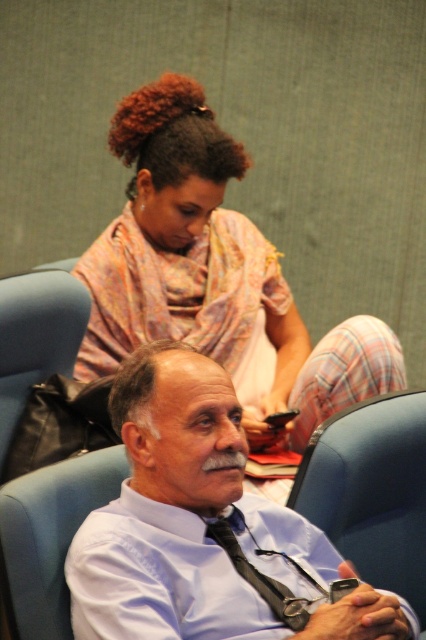
Question: Does light blue shirt at center appear under printed silk blouse at upper center?

Choices:
 (A) yes
 (B) no

Answer: (A)

Question: Which of the following is the closest to the observer?

Choices:
 (A) (273, 564)
 (B) (249, 566)

Answer: (B)

Question: Does light blue shirt at center have a larger size compared to printed silk blouse at upper center?

Choices:
 (A) yes
 (B) no

Answer: (B)

Question: Which point appears closest to the camera in this image?

Choices:
 (A) (299, 570)
 (B) (115, 397)
 (C) (227, 136)

Answer: (A)

Question: Is printed silk blouse at upper center to the left of black satin tie at lower center from the viewer's perspective?

Choices:
 (A) no
 (B) yes

Answer: (B)

Question: Among these objects, which one is farthest from the camera?

Choices:
 (A) black satin tie at lower center
 (B) light blue shirt at center
 (C) printed silk blouse at upper center

Answer: (C)